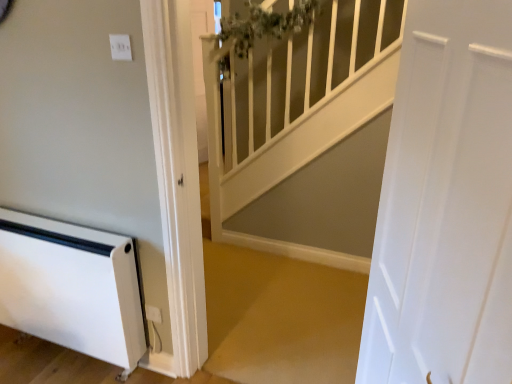
Image resolution: width=512 pixels, height=384 pixels. Find the location of `free point above white plastic heater at lower left (from a real-world perspective)`. free point above white plastic heater at lower left (from a real-world perspective) is located at coordinates (42, 231).